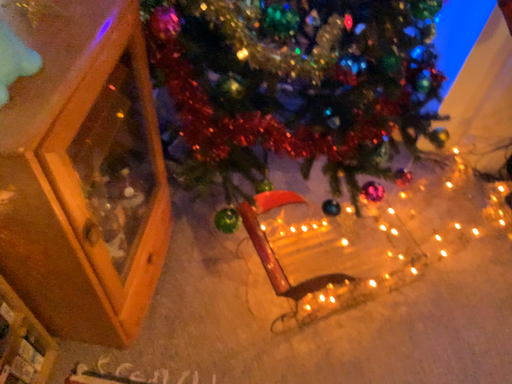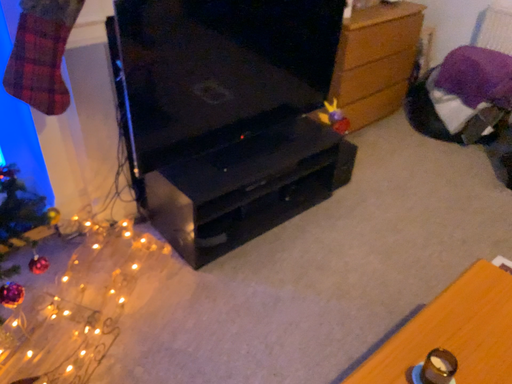
Question: Which way did the camera rotate in the video?

Choices:
 (A) rotated left
 (B) rotated right

Answer: (B)